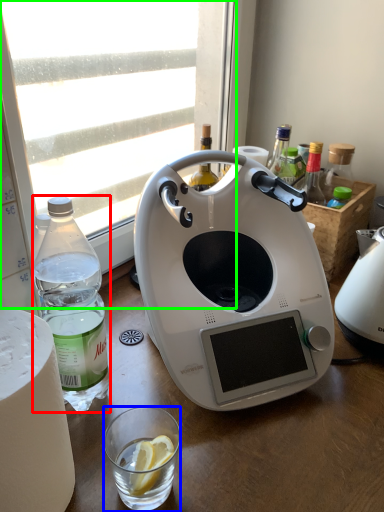
Question: Which is farther away from bottle (highlighted by a red box)? coffee cup (highlighted by a blue box) or window (highlighted by a green box)?

Choices:
 (A) coffee cup
 (B) window

Answer: (B)